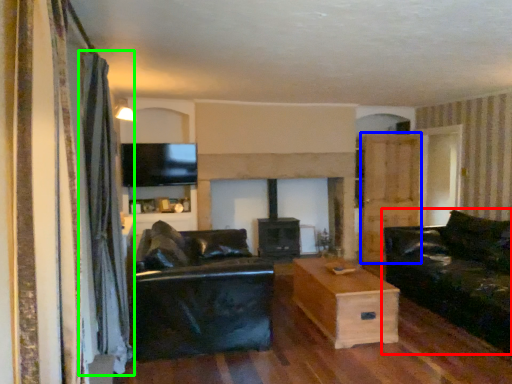
Question: Estimate the real-world distances between objects in this image. Which object is farther from studio couch (highlighted by a red box), armoire (highlighted by a blue box) or curtain (highlighted by a green box)?

Choices:
 (A) armoire
 (B) curtain

Answer: (B)